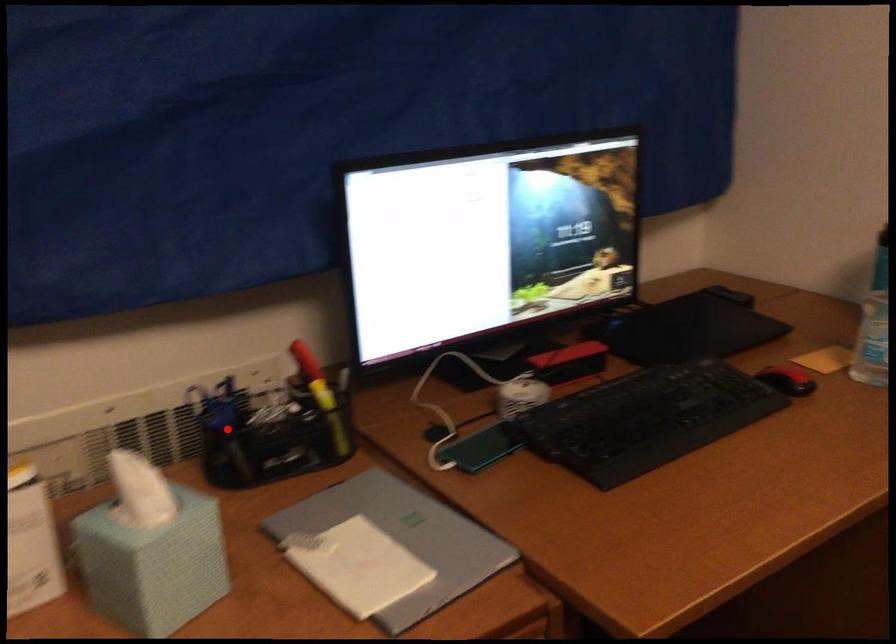
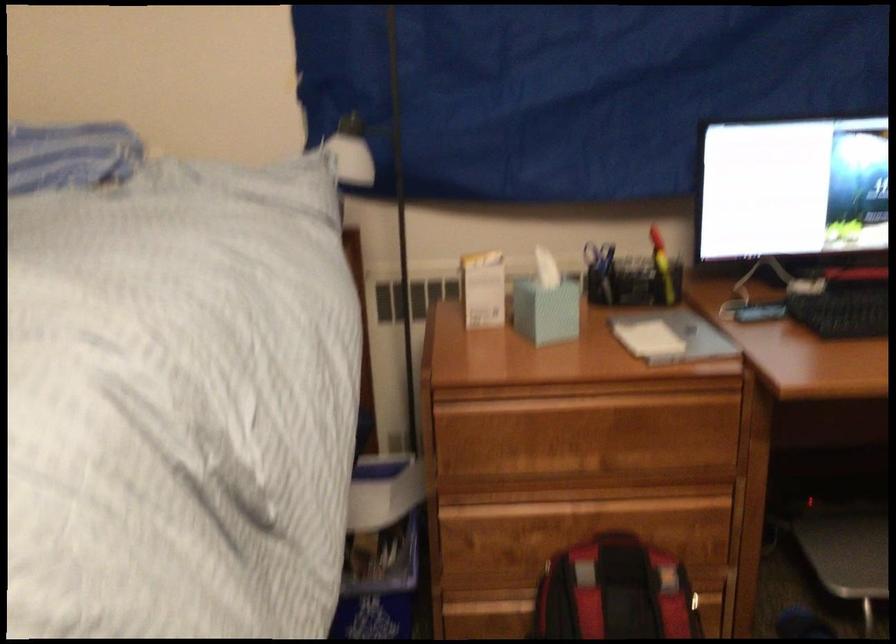
In the second image, find the point that corresponds to the highlighted location in the first image.

(599, 272)